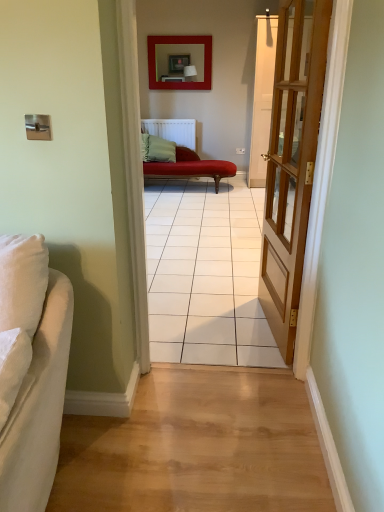
Image resolution: width=384 pixels, height=512 pixels. I want to click on free space to the left of light brown wooden door at right, so click(211, 328).